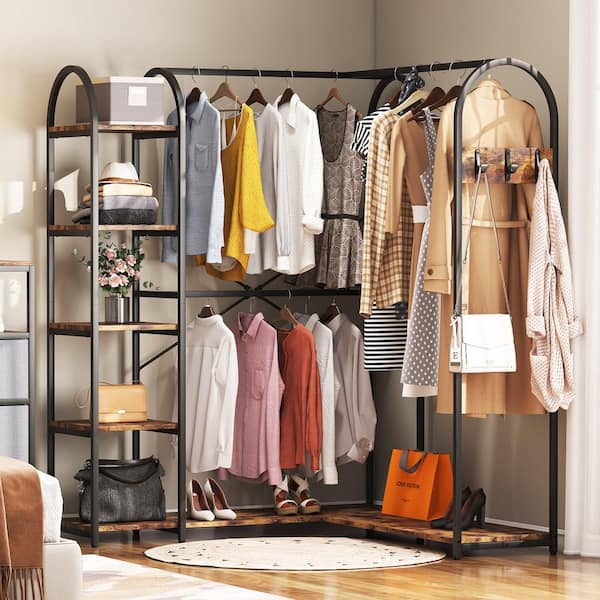
Image resolution: width=600 pixels, height=600 pixels. I want to click on wooden shelf, so click(x=133, y=523), click(x=148, y=421), click(x=148, y=324), click(x=142, y=227), click(x=118, y=124).